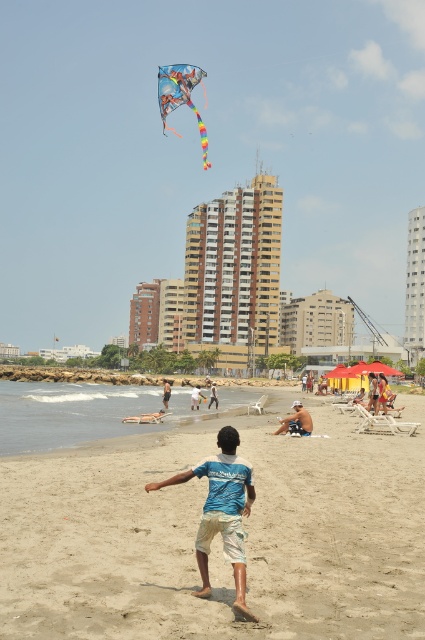
At what (x,y) coordinates should I click in order to perform the action: click on white cotton shorts at center. Please return your answer as a coordinate pair (x, y). The height and width of the screenshot is (640, 425). Looking at the image, I should click on (195, 397).

Does white cotton shorts at center appear under tan shorts at lower center?

Yes, white cotton shorts at center is below tan shorts at lower center.

Image resolution: width=425 pixels, height=640 pixels. In order to click on white cotton shorts at center in this screenshot , I will do `click(195, 397)`.

Can you confirm if rainbow fabric kite at upper center is positioned to the left of blue denim shorts at center?

Yes, rainbow fabric kite at upper center is to the left of blue denim shorts at center.

Between rainbow fabric kite at upper center and blue denim shorts at center, which one has less height?

blue denim shorts at center

The image size is (425, 640). Find the location of `rainbow fabric kite at upper center`. rainbow fabric kite at upper center is located at coordinates (181, 97).

Which is behind, point (64, 528) or point (289, 424)?

The point (289, 424) is more distant.

Does point (333, 440) come farther from viewer compared to point (305, 417)?

That is False.

This screenshot has width=425, height=640. Identify the location of sandy beach at center. (218, 536).